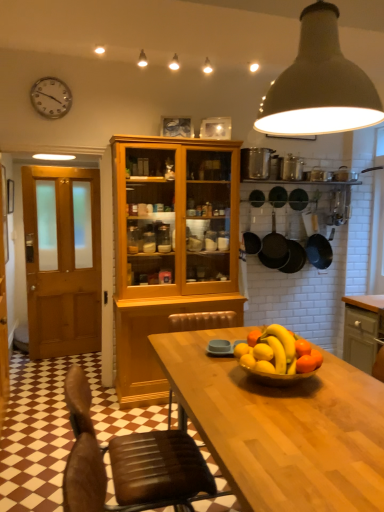
Question: Can matte gray cabinet at right be found inside white matte pendant light at upper center?

Choices:
 (A) yes
 (B) no

Answer: (B)

Question: From a real-world perspective, is white matte pendant light at upper center located beneath matte gray cabinet at right?

Choices:
 (A) yes
 (B) no

Answer: (B)

Question: Is white matte pendant light at upper center closer to camera compared to matte gray cabinet at right?

Choices:
 (A) yes
 (B) no

Answer: (A)

Question: From a real-world perspective, is white matte pendant light at upper center on matte gray cabinet at right?

Choices:
 (A) yes
 (B) no

Answer: (A)

Question: Would you consider white matte pendant light at upper center to be distant from matte gray cabinet at right?

Choices:
 (A) no
 (B) yes

Answer: (B)

Question: Does point (319, 352) appear closer or farther from the camera than point (23, 190)?

Choices:
 (A) closer
 (B) farther

Answer: (A)

Question: From the image's perspective, is shiny golden bowl at center located above or below wooden door at left?

Choices:
 (A) below
 (B) above

Answer: (A)

Question: In terms of height, does shiny golden bowl at center look taller or shorter compared to wooden door at left?

Choices:
 (A) short
 (B) tall

Answer: (A)

Question: In the image, is shiny golden bowl at center on the left side or the right side of wooden door at left?

Choices:
 (A) left
 (B) right

Answer: (B)

Question: From the image's perspective, is brown leather chair at lower center positioned above or below wooden door at left?

Choices:
 (A) above
 (B) below

Answer: (B)

Question: Is brown leather chair at lower center inside the boundaries of wooden door at left, or outside?

Choices:
 (A) inside
 (B) outside

Answer: (B)

Question: Considering the positions of brown leather chair at lower center and wooden door at left in the image, is brown leather chair at lower center wider or thinner than wooden door at left?

Choices:
 (A) wide
 (B) thin

Answer: (A)

Question: From a real-world perspective, is brown leather chair at lower center positioned above or below wooden door at left?

Choices:
 (A) above
 (B) below

Answer: (B)

Question: Is silver metallic clock at upper left in front of or behind white matte pendant light at upper center in the image?

Choices:
 (A) front
 (B) behind

Answer: (B)

Question: From a real-world perspective, is silver metallic clock at upper left above or below white matte pendant light at upper center?

Choices:
 (A) below
 (B) above

Answer: (B)